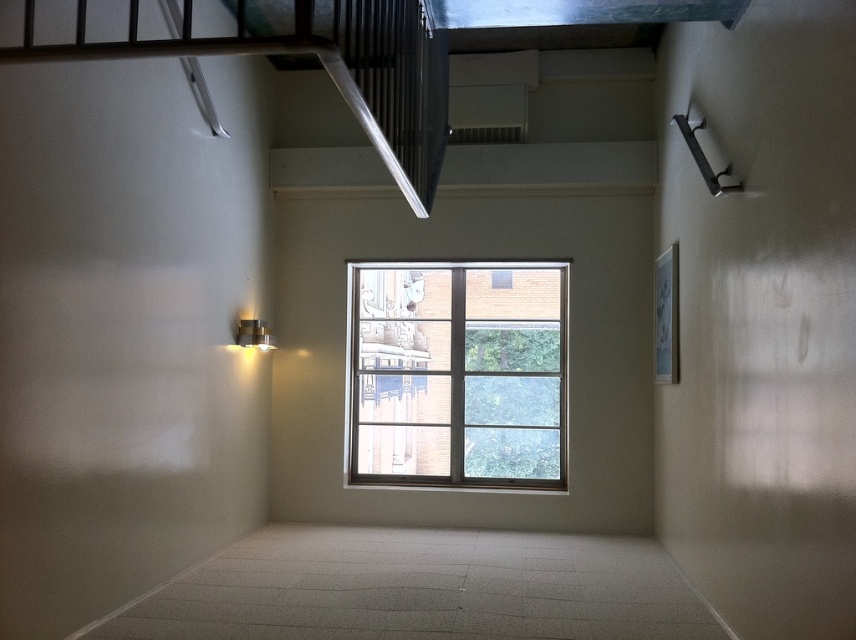
Question: Among these objects, which one is nearest to the camera?

Choices:
 (A) clear glass window at center
 (B) metallic silver stairwell at upper left

Answer: (B)

Question: Is clear glass window at center closer to camera compared to metallic silver stairwell at upper left?

Choices:
 (A) yes
 (B) no

Answer: (B)

Question: Can you confirm if clear glass window at center is thinner than metallic silver stairwell at upper left?

Choices:
 (A) yes
 (B) no

Answer: (B)

Question: Does clear glass window at center have a greater width compared to metallic silver stairwell at upper left?

Choices:
 (A) yes
 (B) no

Answer: (A)

Question: Which point is closer to the camera?

Choices:
 (A) metallic silver stairwell at upper left
 (B) clear glass window at center

Answer: (A)

Question: Among these points, which one is nearest to the camera?

Choices:
 (A) (367, 340)
 (B) (107, 51)

Answer: (B)